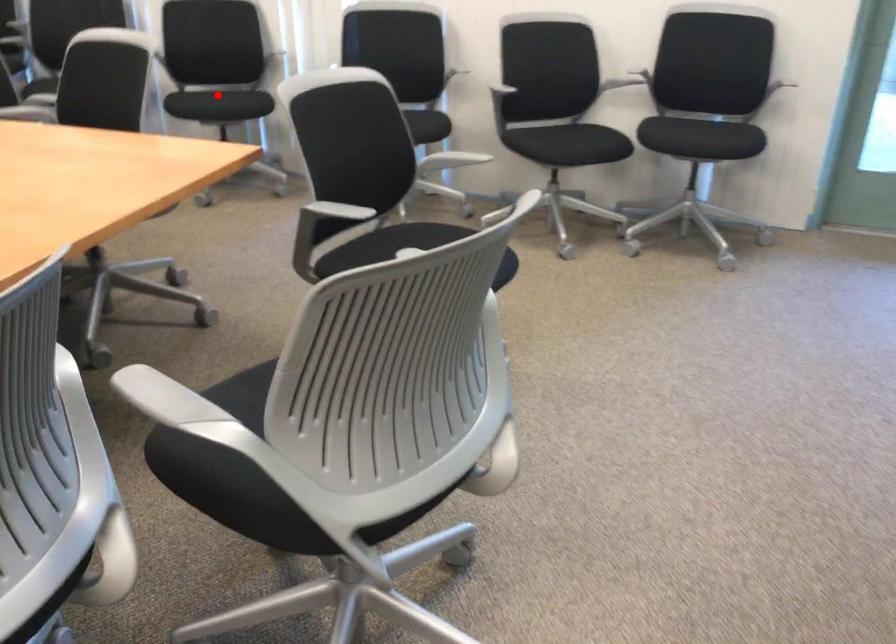
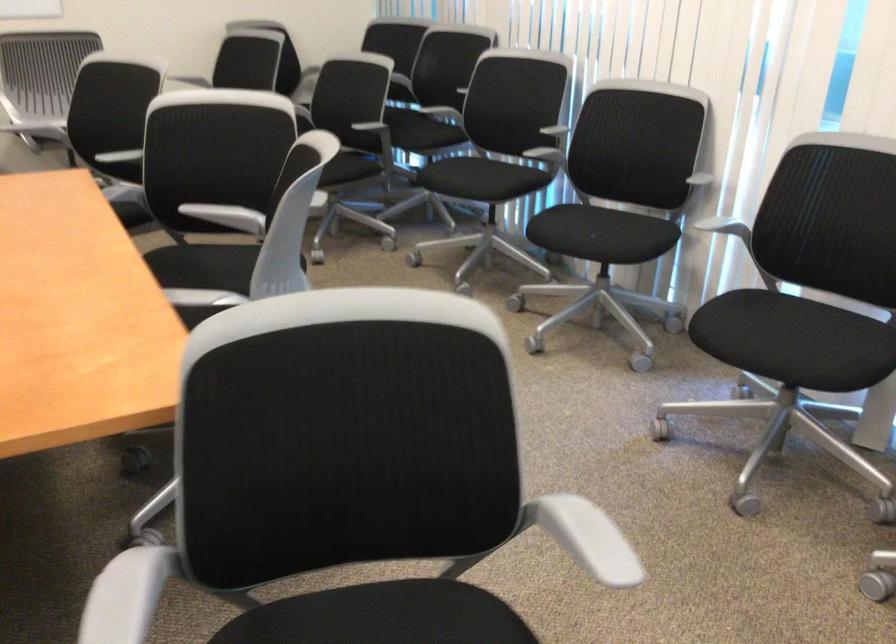
Question: I am providing you with two images of the same scene from different viewpoints. Given a red point in image1, look at the same physical point in image2. Is it:

Choices:
 (A) Closer to the viewpoint
 (B) Farther from the viewpoint

Answer: (A)